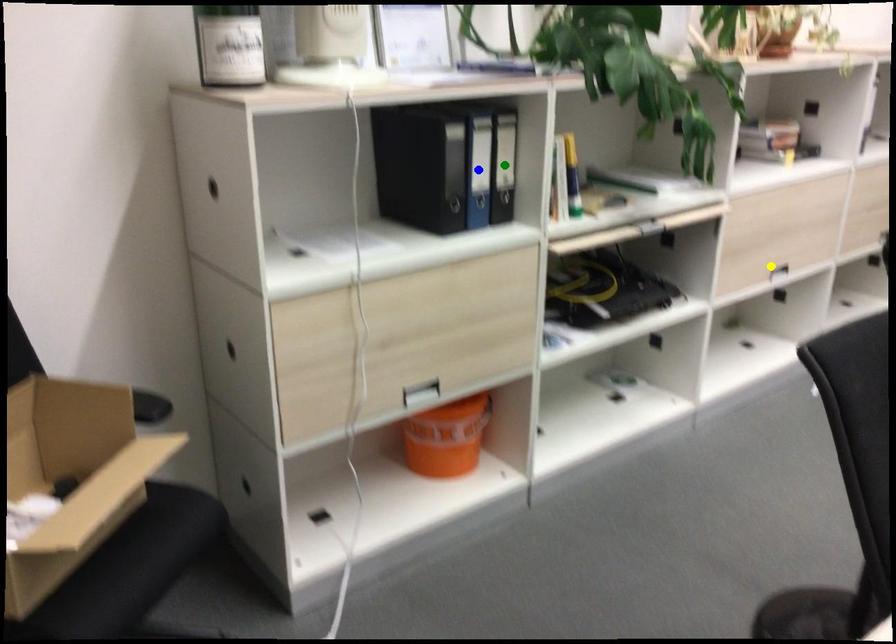
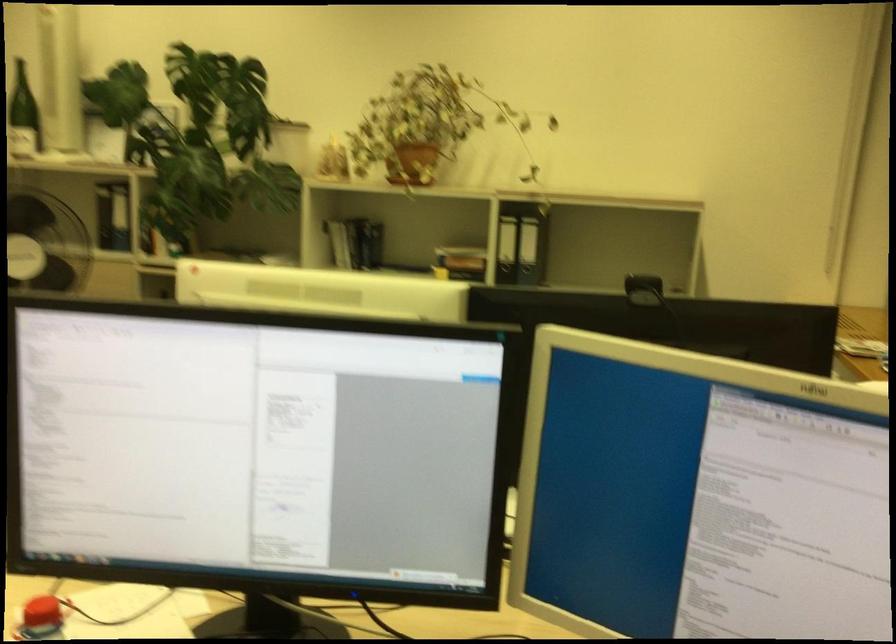
I am providing you with two images of the same scene from different viewpoints. Three points are marked in image1. Which point corresponds to a part or object that is occluded in image2?In image1, three points are marked. Which of them correspond to a part or object that is occluded in image2?Among the three points shown in image1, which one corresponds to a part or object that is no longer visible due to occlusion in image2?

blue point, green point, yellow point